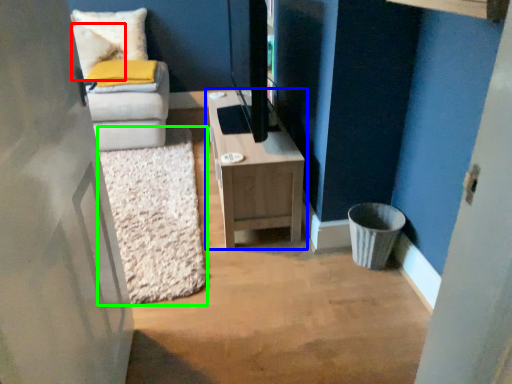
Question: Considering the real-world distances, which object is closest to pillow (highlighted by a red box)? table (highlighted by a blue box) or mat (highlighted by a green box).

Choices:
 (A) table
 (B) mat

Answer: (B)